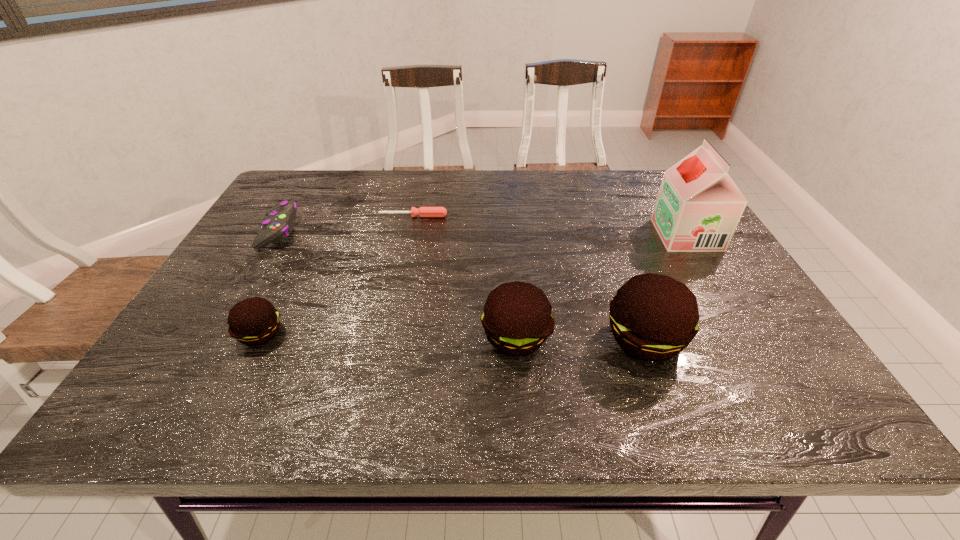
This screenshot has width=960, height=540. What are the coordinates of `vacant region located 0.110m on the right of the shortest patty` in the screenshot? It's located at (335, 334).

Image resolution: width=960 pixels, height=540 pixels. In order to click on free region located on the left of the fourth object from left to right in this screenshot , I will do `click(414, 337)`.

Where is `free space located 0.120m on the left of the rightmost patty`? free space located 0.120m on the left of the rightmost patty is located at coordinates (546, 339).

This screenshot has height=540, width=960. Identify the location of free space located 0.250m on the left of the third object from left to right. (294, 216).

The image size is (960, 540). I want to click on free space located with the cap open on the rightmost object, so click(x=528, y=235).

The width and height of the screenshot is (960, 540). Find the location of `vacant space located with the cap open on the rightmost object`. vacant space located with the cap open on the rightmost object is located at coordinates (575, 235).

Find the location of a particular element. Image resolution: width=960 pixels, height=540 pixels. free space located 0.060m with the cap open on the rightmost object is located at coordinates (637, 235).

The image size is (960, 540). I want to click on vacant point located 0.100m on the front of the control, so click(252, 276).

The image size is (960, 540). What are the coordinates of `patty located in the left edge section of the desktop` in the screenshot? It's located at (254, 321).

In order to click on control present at the left edge in this screenshot , I will do coord(280,221).